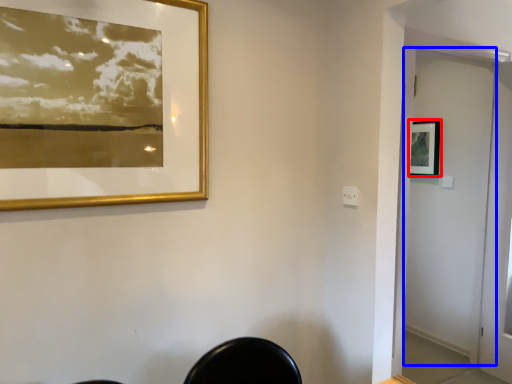
Question: Which object appears closest to the camera in this image, picture frame (highlighted by a red box) or screen door (highlighted by a blue box)?

Choices:
 (A) picture frame
 (B) screen door

Answer: (B)